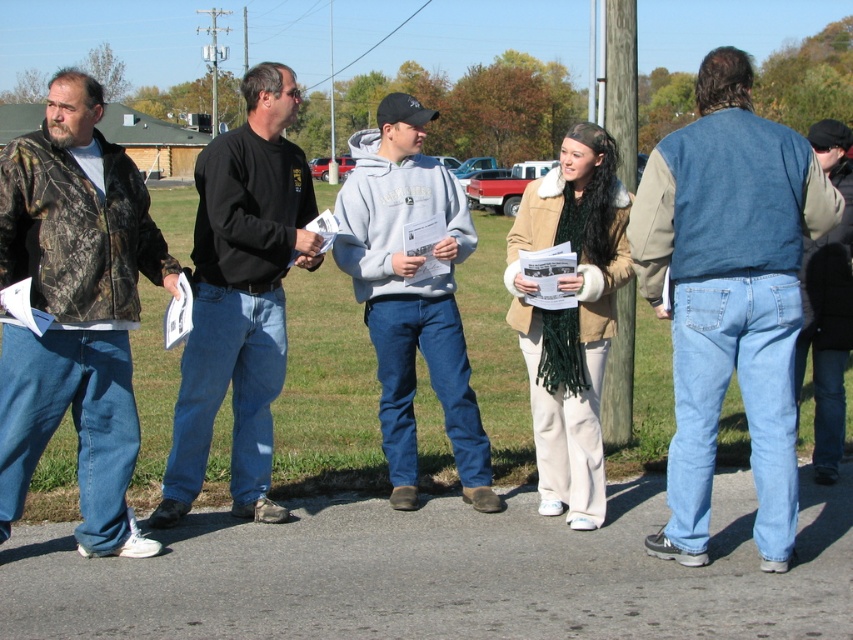
Question: Which point is farther to the camera?

Choices:
 (A) camo jacket at left
 (B) black cotton shirt at center
 (C) denim jacket at center

Answer: (B)

Question: Does black cotton shirt at center appear over gray fleece sweatshirt at center?

Choices:
 (A) no
 (B) yes

Answer: (B)

Question: Estimate the real-world distances between objects in this image. Which object is closer to the black cotton shirt at center?

Choices:
 (A) denim jacket at center
 (B) camo jacket at left

Answer: (B)

Question: Can you confirm if gray fleece sweatshirt at center is bigger than wooden post at center?

Choices:
 (A) yes
 (B) no

Answer: (B)

Question: Which point is closer to the camera?

Choices:
 (A) denim jacket at center
 (B) gray fleece sweatshirt at center
 (C) wooden post at center
 (D) black cotton shirt at center

Answer: (A)

Question: Does black cotton shirt at center appear over gray fleece sweatshirt at center?

Choices:
 (A) no
 (B) yes

Answer: (B)